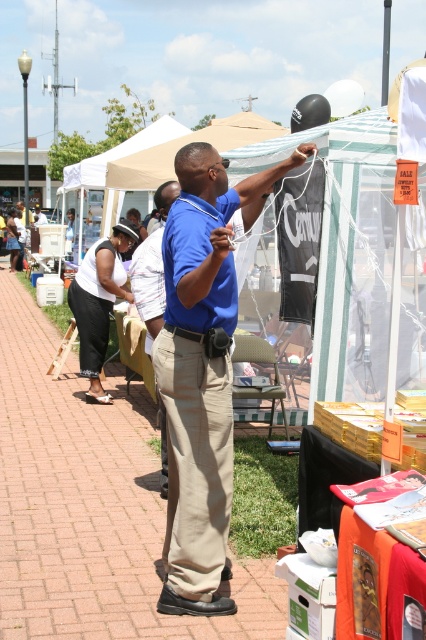
You are a customer at the market and want to see the items on the table. The blue cotton shirt at center and the white mesh canopy at upper center are in your line of sight. Which object is taller and might block your view?

The blue cotton shirt at center is taller than the white mesh canopy at upper center, so it might block your view of the items on the table.

You are a customer at the market and want to approach the stall. Which object, the blue cotton shirt at center or the white mesh canopy at upper center, will you see first as you walk towards the stall?

The blue cotton shirt at center will be seen first because it is positioned in front of the white mesh canopy at upper center, making it closer to your line of sight as you approach the stall.